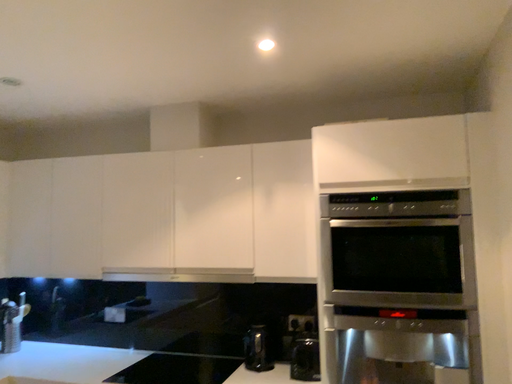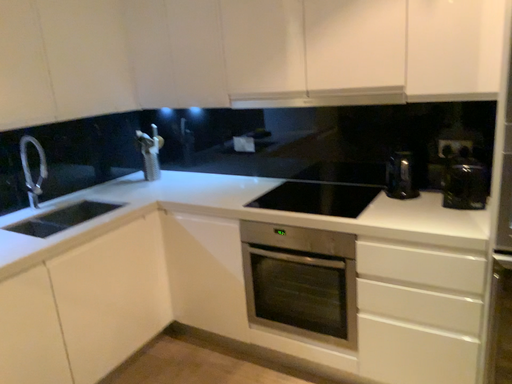
Question: Which way did the camera rotate in the video?

Choices:
 (A) rotated upward
 (B) rotated downward

Answer: (B)